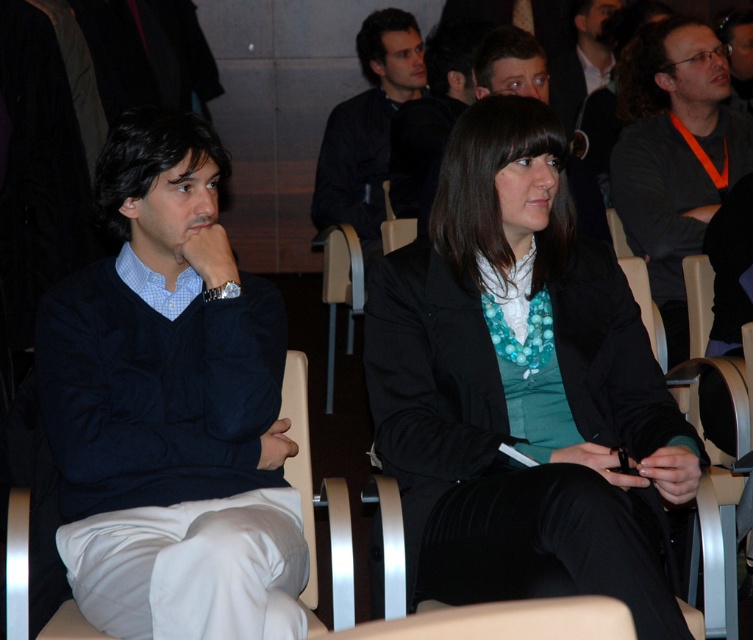
You are standing in the auditorium and want to approach the point marked at coordinates (337, 218). If you walk directly towards it from your current position, how far will you have to walk?

The distance between the point marked at coordinates (337, 218) and the viewer is 4.73 meters, so you will have to walk 4.73 meters to reach it.

You are sitting in the auditorium and want to hand a note to the person wearing the dark blue sweater at left. You are currently sitting in the white fabric chair at center. Which direction should you move to reach them?

Since the dark blue sweater at left is closer to the viewer than the white fabric chair at center, you should move to your left to reach the person wearing the dark blue sweater at left.